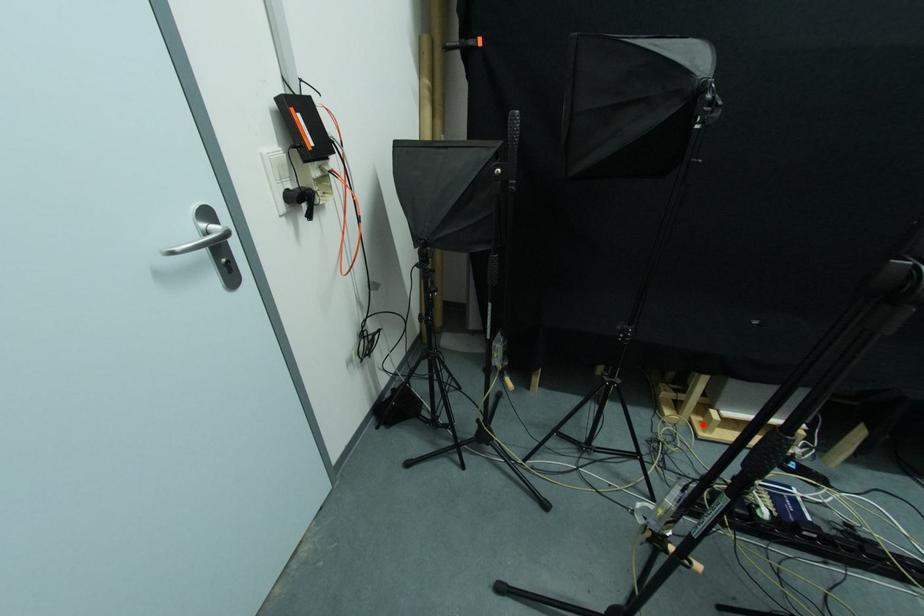
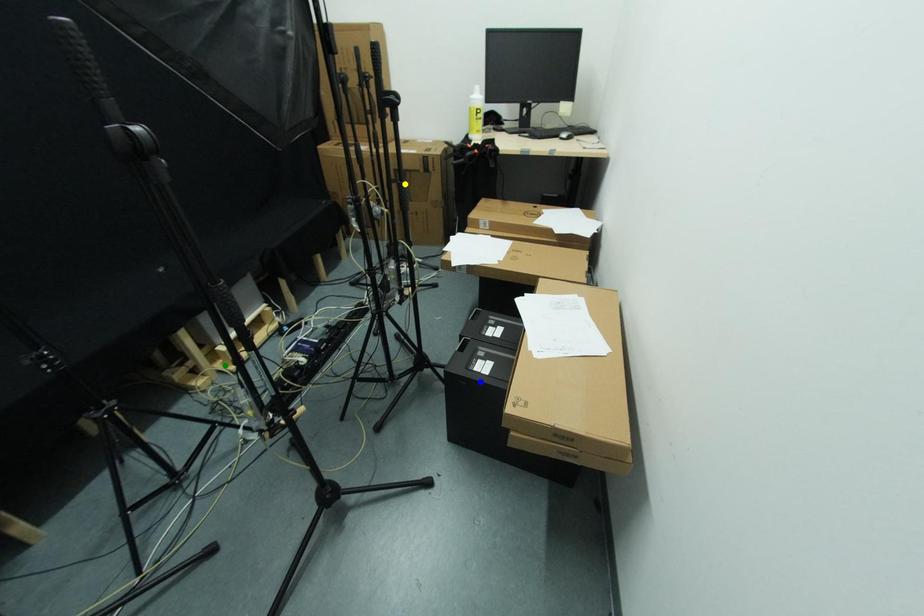
Question: I am providing you with two images of the same scene from different viewpoints. A red point is marked on the first image. You are given multiple points on the second image. Which point in image 2 represents the same 3d spot as the red point in image 1?

Choices:
 (A) green point
 (B) yellow point
 (C) blue point

Answer: (A)